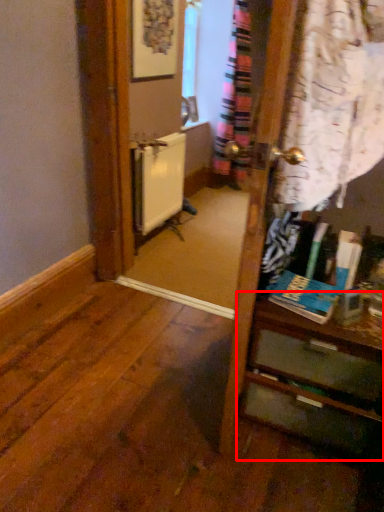
Question: From the image, what is the correct spatial relationship of vanity (annotated by the red box) in relation to radiator?

Choices:
 (A) left
 (B) right

Answer: (B)